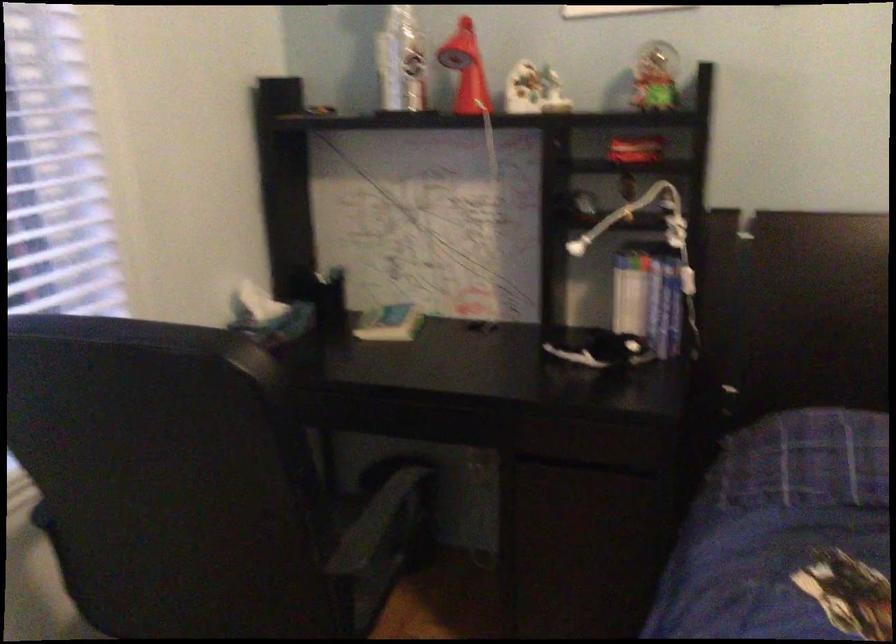
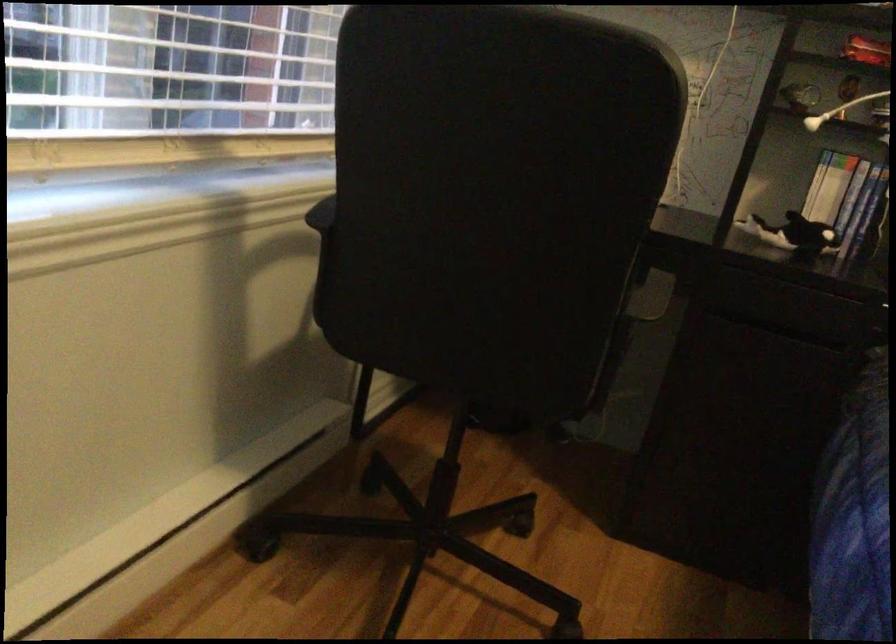
Locate, in the second image, the point that corresponds to (598,348) in the first image.

(793, 234)